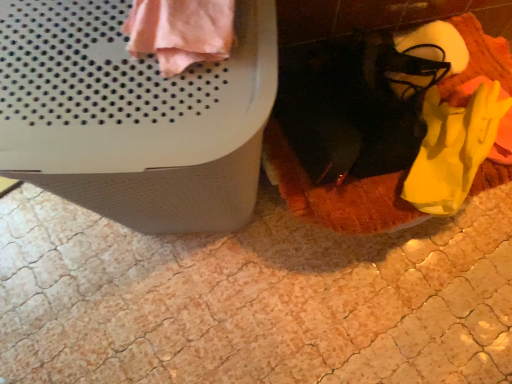
Question: Can you confirm if pink fabric at upper left is shorter than soft orange blanket at lower right?

Choices:
 (A) yes
 (B) no

Answer: (A)

Question: From the image's perspective, is pink fabric at upper left above soft orange blanket at lower right?

Choices:
 (A) yes
 (B) no

Answer: (A)

Question: Is soft orange blanket at lower right at the back of pink fabric at upper left?

Choices:
 (A) no
 (B) yes

Answer: (A)

Question: Could you tell me if pink fabric at upper left is facing soft orange blanket at lower right?

Choices:
 (A) yes
 (B) no

Answer: (B)

Question: Is the depth of pink fabric at upper left greater than that of soft orange blanket at lower right?

Choices:
 (A) no
 (B) yes

Answer: (A)

Question: Is white textured waste container at upper left wider or thinner than yellow fabric shoe at lower right?

Choices:
 (A) thin
 (B) wide

Answer: (B)

Question: From the image's perspective, relative to yellow fabric shoe at lower right, is white textured waste container at upper left above or below?

Choices:
 (A) below
 (B) above

Answer: (A)

Question: Choose the correct answer: Is white textured waste container at upper left inside yellow fabric shoe at lower right or outside it?

Choices:
 (A) outside
 (B) inside

Answer: (A)

Question: In the image, is white textured waste container at upper left positioned in front of or behind yellow fabric shoe at lower right?

Choices:
 (A) behind
 (B) front

Answer: (B)

Question: Does point (139, 16) appear closer or farther from the camera than point (436, 21)?

Choices:
 (A) farther
 (B) closer

Answer: (B)

Question: Looking at the image, does pink fabric at upper left seem bigger or smaller compared to yellow fabric shoe at lower right?

Choices:
 (A) big
 (B) small

Answer: (A)

Question: Considering the relative positions of pink fabric at upper left and yellow fabric shoe at lower right in the image provided, is pink fabric at upper left to the left or to the right of yellow fabric shoe at lower right?

Choices:
 (A) left
 (B) right

Answer: (A)

Question: From the image's perspective, is pink fabric at upper left above or below yellow fabric shoe at lower right?

Choices:
 (A) above
 (B) below

Answer: (B)

Question: From the image's perspective, is yellow fabric shoe at lower right positioned above or below pink fabric at upper left?

Choices:
 (A) above
 (B) below

Answer: (A)

Question: Considering the positions of yellow fabric shoe at lower right and pink fabric at upper left in the image, is yellow fabric shoe at lower right bigger or smaller than pink fabric at upper left?

Choices:
 (A) big
 (B) small

Answer: (B)